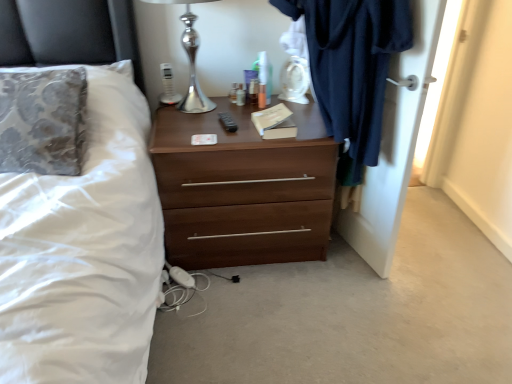
The height and width of the screenshot is (384, 512). I want to click on vacant space to the right of dark blue fabric at right, so [431, 260].